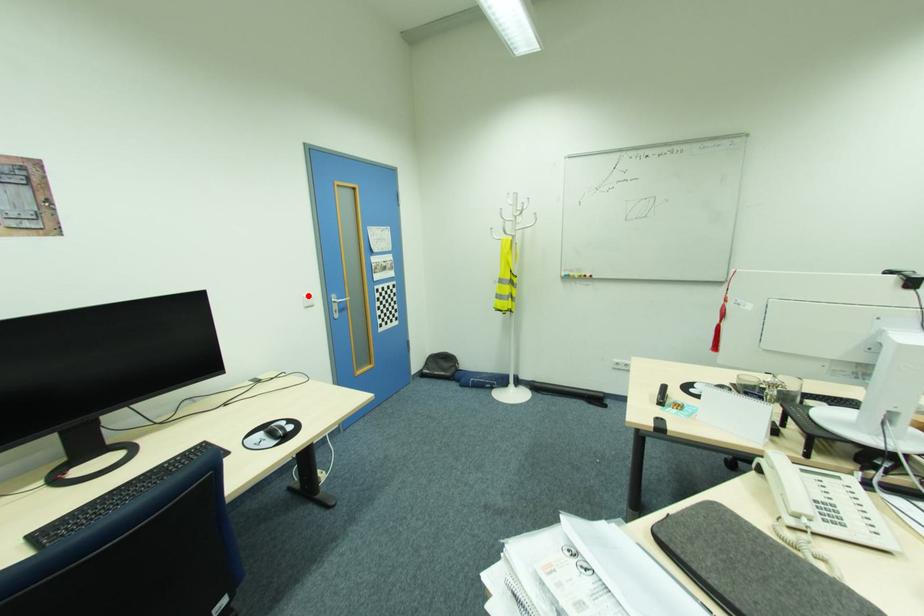
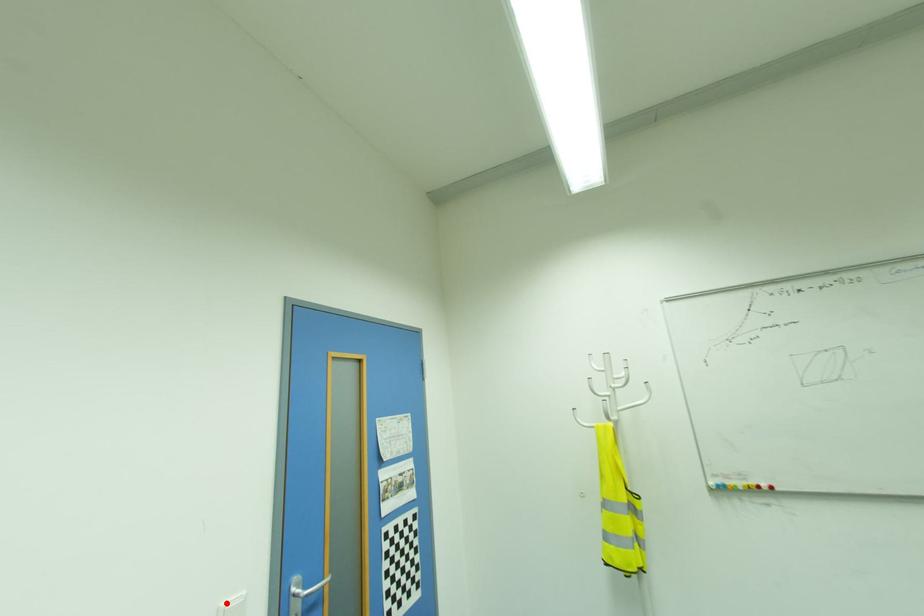
I am providing you with two images of the same scene from different viewpoints. A red point is marked on the first image and another point is marked on the second image. Is the marked point in image1 the same physical position as the marked point in image2?

Yes